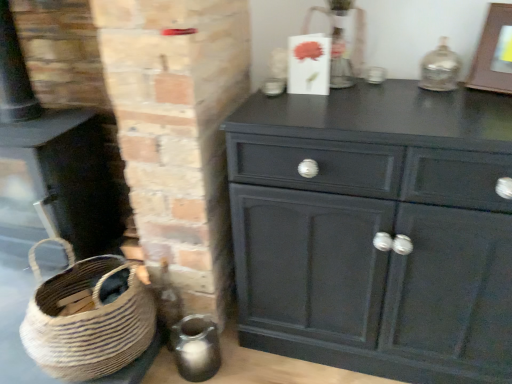
Question: From the image's perspective, is wooden picture frame at upper right located above matte black fireplace at lower left?

Choices:
 (A) no
 (B) yes

Answer: (B)

Question: Can you confirm if wooden picture frame at upper right is bigger than matte black fireplace at lower left?

Choices:
 (A) yes
 (B) no

Answer: (B)

Question: Is wooden picture frame at upper right next to matte black fireplace at lower left?

Choices:
 (A) no
 (B) yes

Answer: (A)

Question: From a real-world perspective, is wooden picture frame at upper right under matte black fireplace at lower left?

Choices:
 (A) yes
 (B) no

Answer: (B)

Question: From a real-world perspective, is wooden picture frame at upper right over matte black fireplace at lower left?

Choices:
 (A) yes
 (B) no

Answer: (A)

Question: From the image's perspective, does wooden picture frame at upper right appear lower than matte black fireplace at lower left?

Choices:
 (A) no
 (B) yes

Answer: (A)

Question: Is matte black fireplace at lower left not within matte black cabinet at center?

Choices:
 (A) no
 (B) yes

Answer: (B)

Question: Could you tell me if matte black fireplace at lower left is turned towards matte black cabinet at center?

Choices:
 (A) yes
 (B) no

Answer: (B)

Question: From a real-world perspective, is matte black fireplace at lower left positioned over matte black cabinet at center based on gravity?

Choices:
 (A) yes
 (B) no

Answer: (A)

Question: Is matte black cabinet at center a part of matte black fireplace at lower left?

Choices:
 (A) no
 (B) yes

Answer: (A)

Question: Does matte black fireplace at lower left have a greater width compared to matte black cabinet at center?

Choices:
 (A) no
 (B) yes

Answer: (A)

Question: Is matte black fireplace at lower left smaller than matte black cabinet at center?

Choices:
 (A) yes
 (B) no

Answer: (A)

Question: From the image's perspective, is natural woven basket at lower left on top of matte black cabinet at center?

Choices:
 (A) yes
 (B) no

Answer: (B)